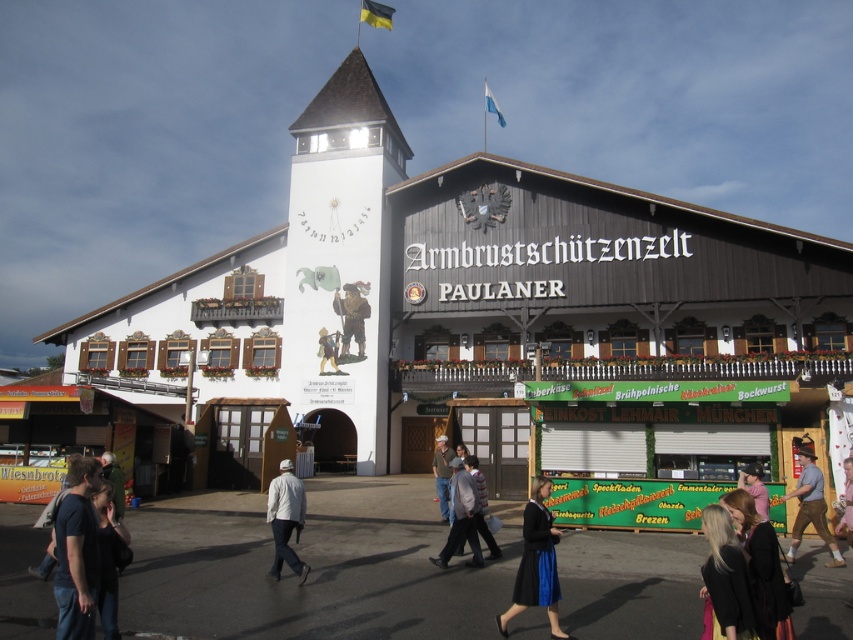
You are a photographer standing in front of the Armbrustschutzentzel building. You want to take a picture of the blue satin skirt at lower center and the wooden statue at center. Which object is closer to the camera?

The blue satin skirt at lower center is positioned under the wooden statue at center, so the blue satin skirt at lower center is closer to the camera.